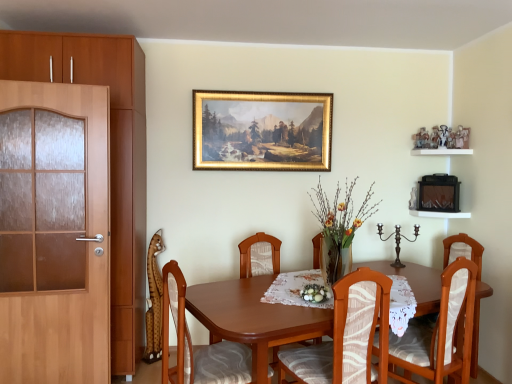
Where is `free space to the left of white fabric floral arrangement at center, which is the 2th floral arrangement from top to bottom`? The height and width of the screenshot is (384, 512). free space to the left of white fabric floral arrangement at center, which is the 2th floral arrangement from top to bottom is located at coordinates (285, 297).